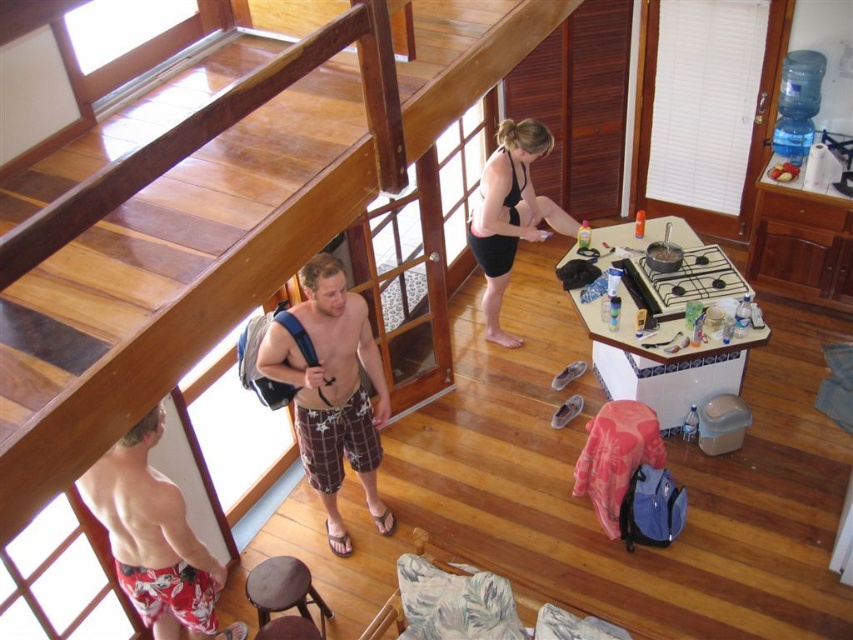
You are designing a shelf that needs to be placed between the wooden at upper center and the brown wooden stool at lower center. Which object should the shelf be wider than to ensure it fits properly?

The shelf should be wider than the wooden at upper center because its width is larger than the brown wooden stool at lower center.

You are standing at point (166, 253) in the image. What object is located at your current position?

The wooden at upper center is located at point (166, 253).